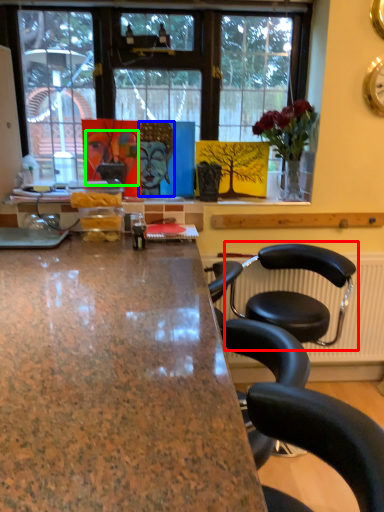
Question: Estimate the real-world distances between objects in this image. Which object is farther from chair (highlighted by a red box), person (highlighted by a blue box) or human face (highlighted by a green box)?

Choices:
 (A) person
 (B) human face

Answer: (B)